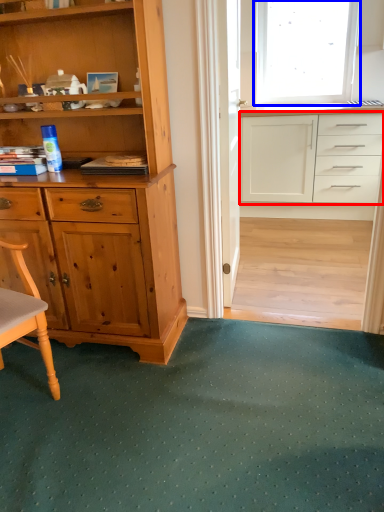
Question: Which object appears closest to the camera in this image, cabinetry (highlighted by a red box) or window (highlighted by a blue box)?

Choices:
 (A) cabinetry
 (B) window

Answer: (A)